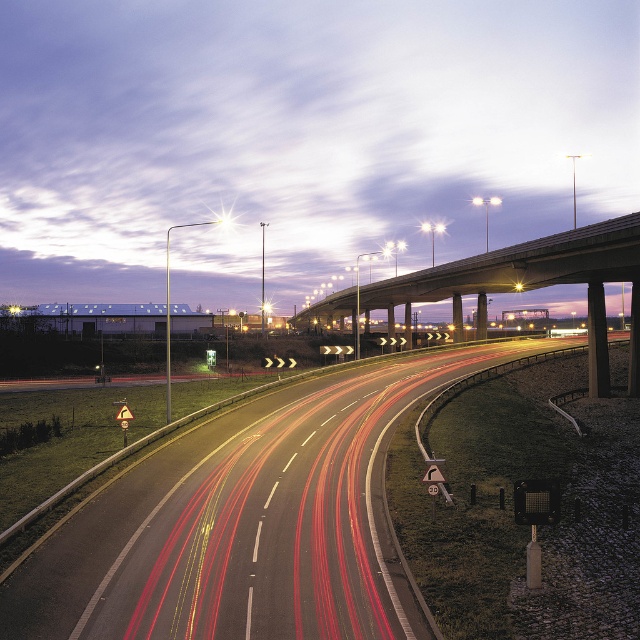
You are standing at the point labeled point (248, 524) on the image. What type of surface are you currently standing on?

You are standing on the smooth asphalt highway at center, as the point (248, 524) represents this surface.

You are a drone operator trying to capture the smooth asphalt highway at center. What are the coordinates where you should focus your camera?

The smooth asphalt highway at center is located at coordinates point (248,524).